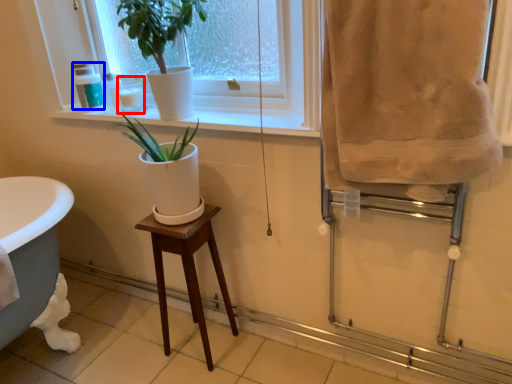
Question: Among these objects, which one is farthest to the camera, toiletry (highlighted by a red box) or toiletry (highlighted by a blue box)?

Choices:
 (A) toiletry
 (B) toiletry

Answer: (B)